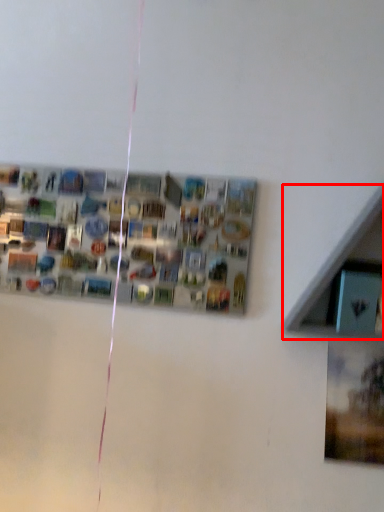
Question: From the image's perspective, what is the correct spatial relationship of shelf (annotated by the red box) in relation to bulletin board?

Choices:
 (A) below
 (B) above

Answer: (A)